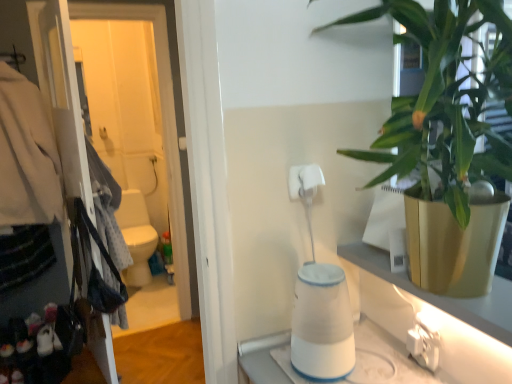
Image resolution: width=512 pixels, height=384 pixels. Find the location of `vacant region to the left of white plastic electric outlet at lower right`. vacant region to the left of white plastic electric outlet at lower right is located at coordinates (379, 366).